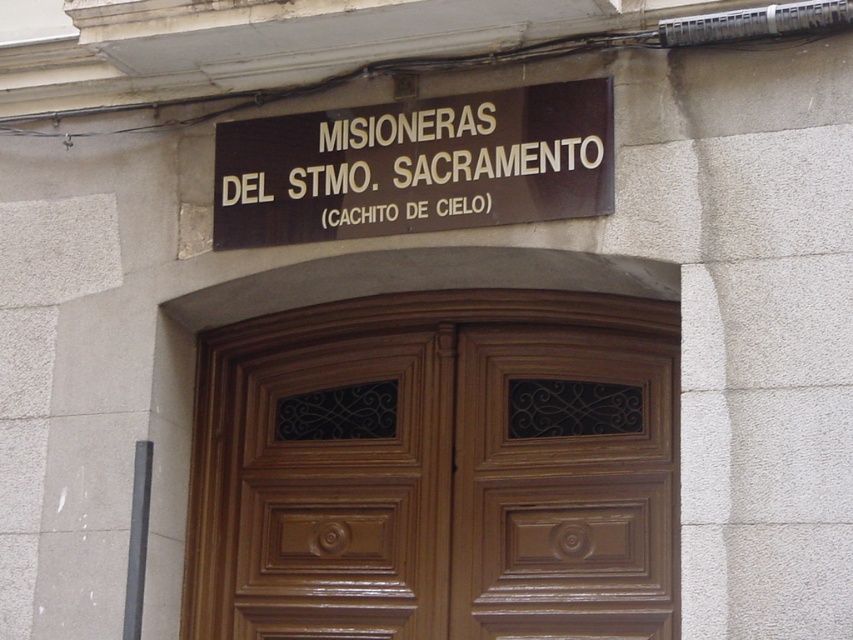
Does glossy wood door at center come behind brown polished wood sign at upper center?

That is True.

Between point (407, 358) and point (235, 228), which one is positioned in front?

Positioned in front is point (235, 228).

Does point (519, 474) come closer to viewer compared to point (323, 236)?

No, (519, 474) is further to viewer.

Find the location of a particular element. Image resolution: width=853 pixels, height=640 pixels. glossy wood door at center is located at coordinates (436, 468).